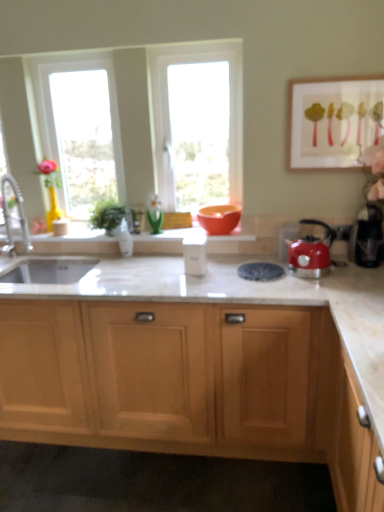
Find the location of a particular element. The width and height of the screenshot is (384, 512). vacant area that lies to the right of red glossy kettle at right is located at coordinates (342, 275).